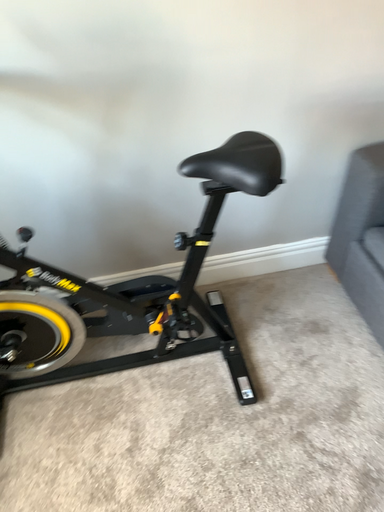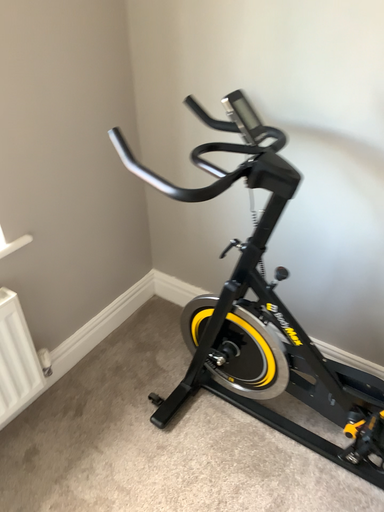
Question: How did the camera likely rotate when shooting the video?

Choices:
 (A) rotated downward
 (B) rotated upward

Answer: (B)